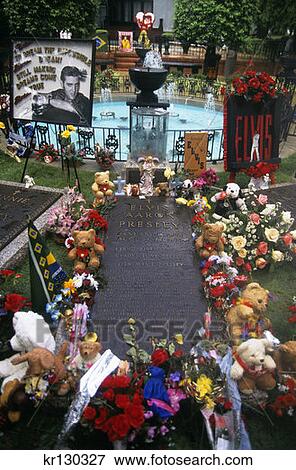
You are a GUI agent. You are given a task and a screenshot of the screen. Output one action in this format:
    pyautogui.click(x=<x>, y=<y>)
    Task: Click on the engraved plaque
    This screenshot has height=470, width=296.
    Given the screenshot: What is the action you would take?
    pyautogui.click(x=137, y=217)